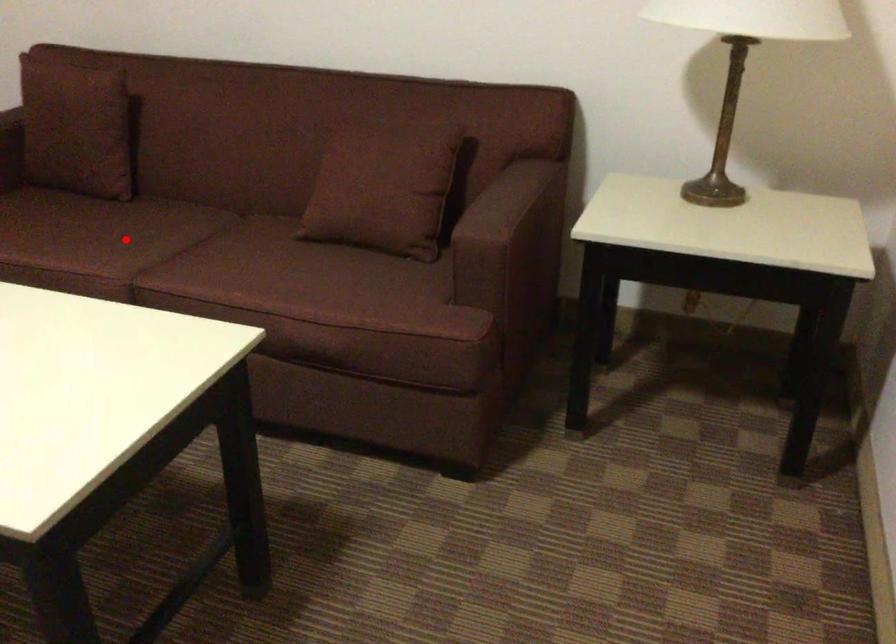
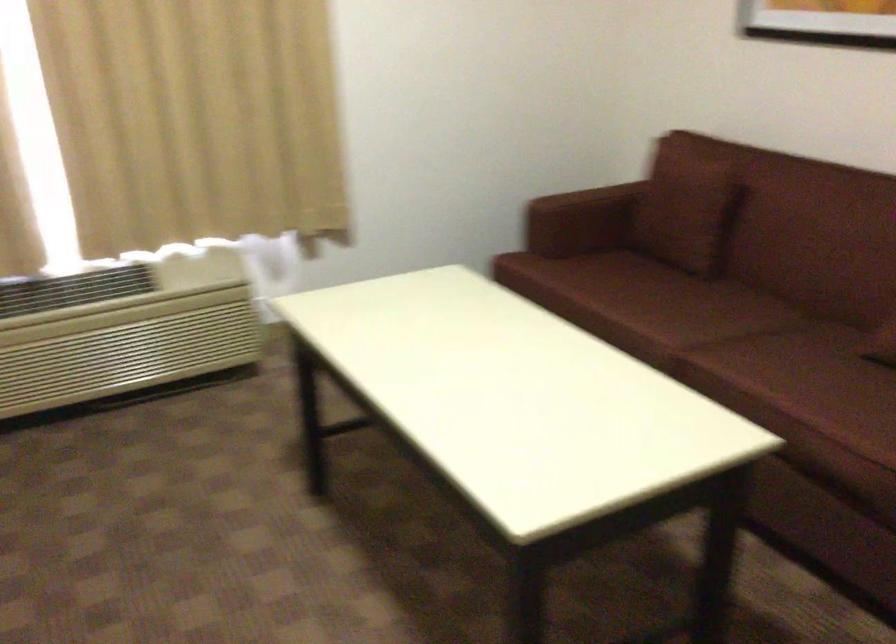
Find the pixel in the second image that matches the highlighted location in the first image.

(682, 310)